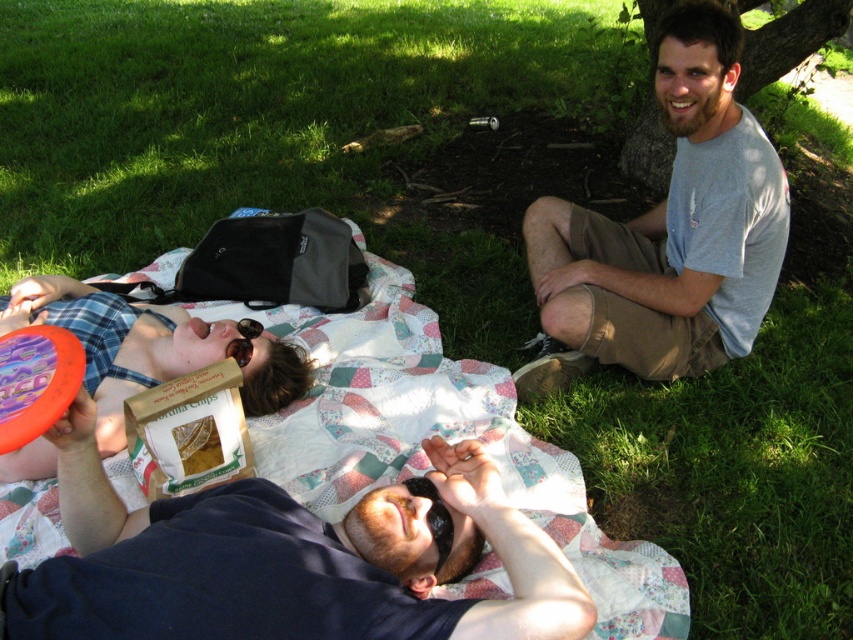
You are planning to pack your lunch for a picnic and need to choose between the matte brown bag at upper left and the green bark tree at upper right. Based on their sizes, which one would be more suitable for carrying your snacks?

The matte brown bag at upper left has a larger size compared to the green bark tree at upper right, so the matte brown bag at upper left would be more suitable for carrying snacks as it can hold more items.